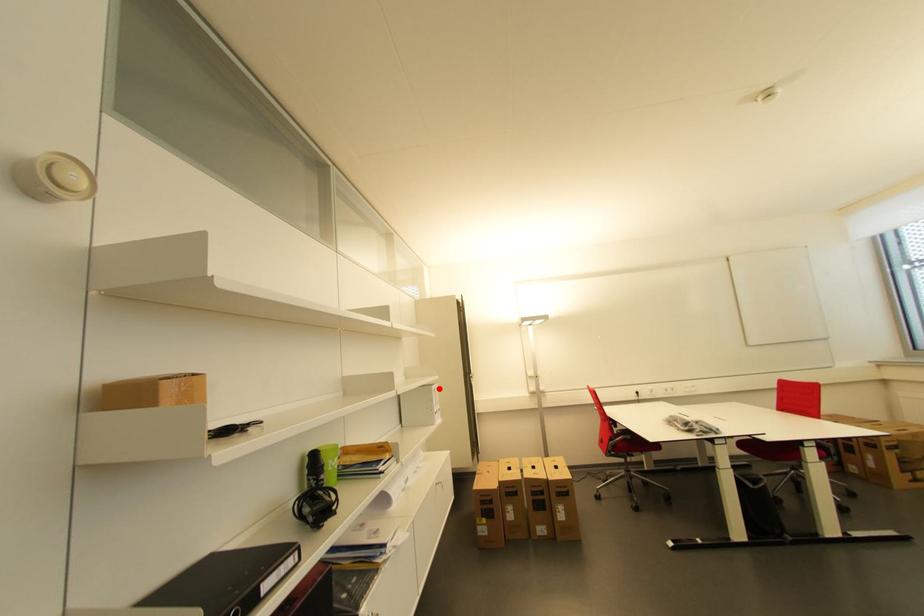
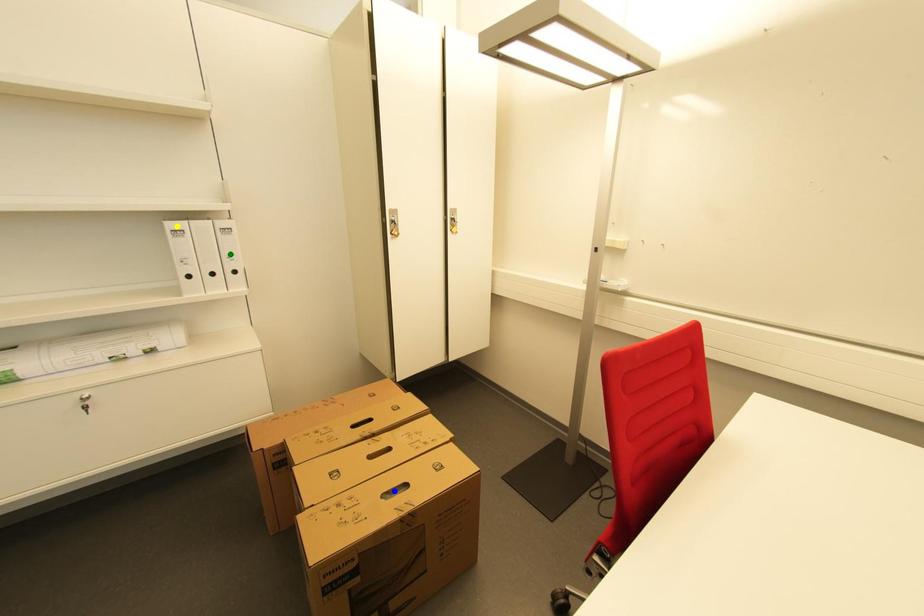
Question: I am providing you with two images of the same scene from different viewpoints. A red point is marked on the first image. You are given multiple points on the second image. Which spot in image 2 lines up with the point in image 1?

Choices:
 (A) green point
 (B) blue point
 (C) yellow point

Answer: (C)